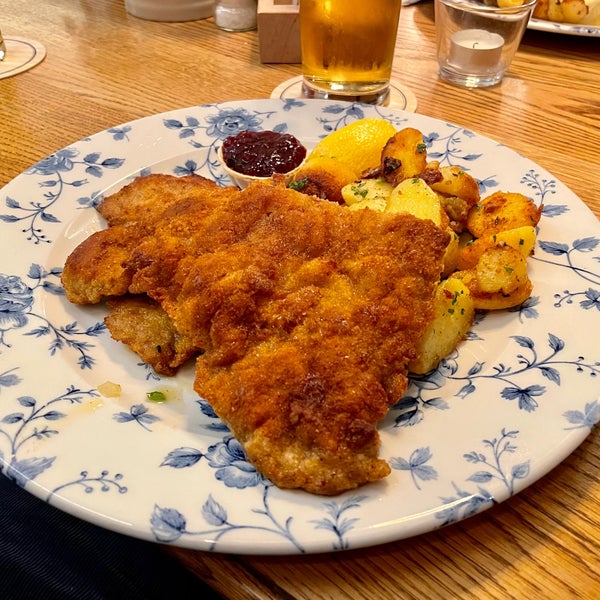
This screenshot has width=600, height=600. I want to click on plate, so click(552, 28).